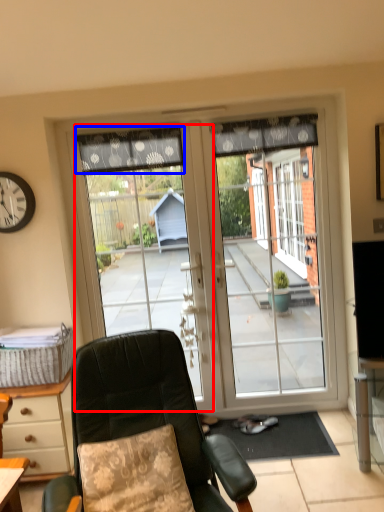
Question: Which object is closer to the camera taking this photo, garage door (highlighted by a red box) or curtain (highlighted by a blue box)?

Choices:
 (A) garage door
 (B) curtain

Answer: (B)